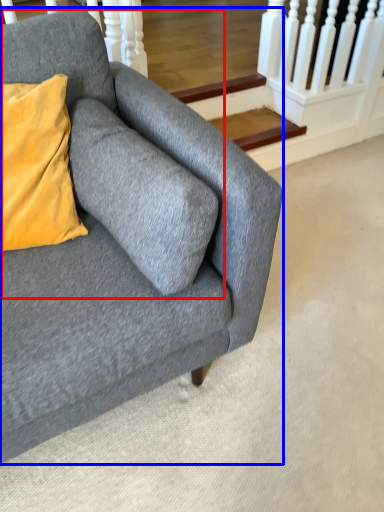
Question: Which point is further to the camera, swivel chair (highlighted by a red box) or studio couch (highlighted by a blue box)?

Choices:
 (A) swivel chair
 (B) studio couch

Answer: (A)